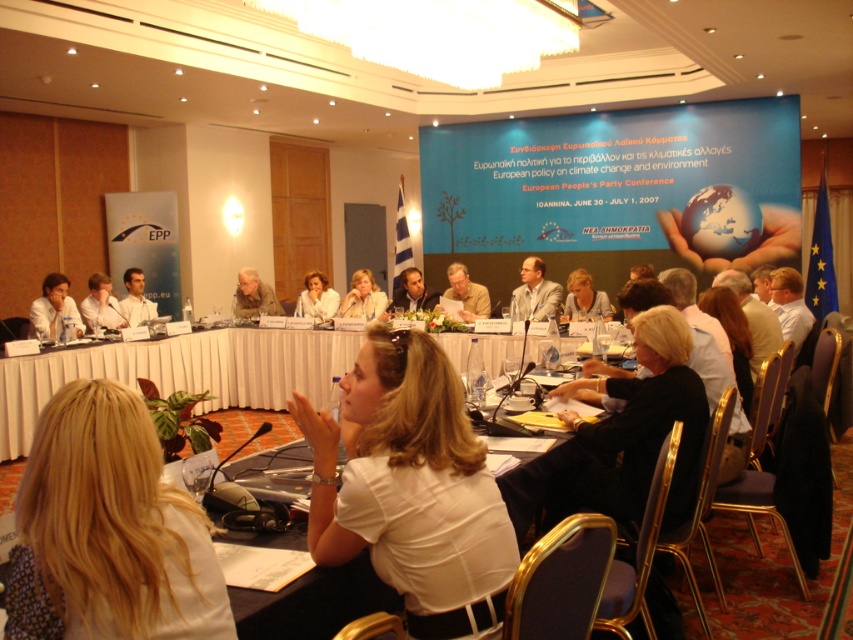
Question: Does white fabric table at center appear on the left side of light beige fabric jacket at center?

Choices:
 (A) no
 (B) yes

Answer: (B)

Question: Does blonde hair at lower left appear under white fabric table at center?

Choices:
 (A) yes
 (B) no

Answer: (B)

Question: Which object is positioned closest to the matte white blouse at center?

Choices:
 (A) light brown hair at center
 (B) white fabric table at center
 (C) light beige fabric jacket at center

Answer: (C)

Question: Which point is closer to the camera?

Choices:
 (A) blonde hair at lower left
 (B) light beige fabric jacket at center
 (C) white fabric table at center
 (D) light brown hair at center

Answer: (A)

Question: Can you confirm if blonde hair at lower left is smaller than light beige fabric jacket at center?

Choices:
 (A) no
 (B) yes

Answer: (B)

Question: Estimate the real-world distances between objects in this image. Which object is closer to the blonde hair at lower left?

Choices:
 (A) white matte shirt at center
 (B) light beige fabric jacket at center
 (C) white fabric table at center
 (D) blonde hair at lower center

Answer: (A)